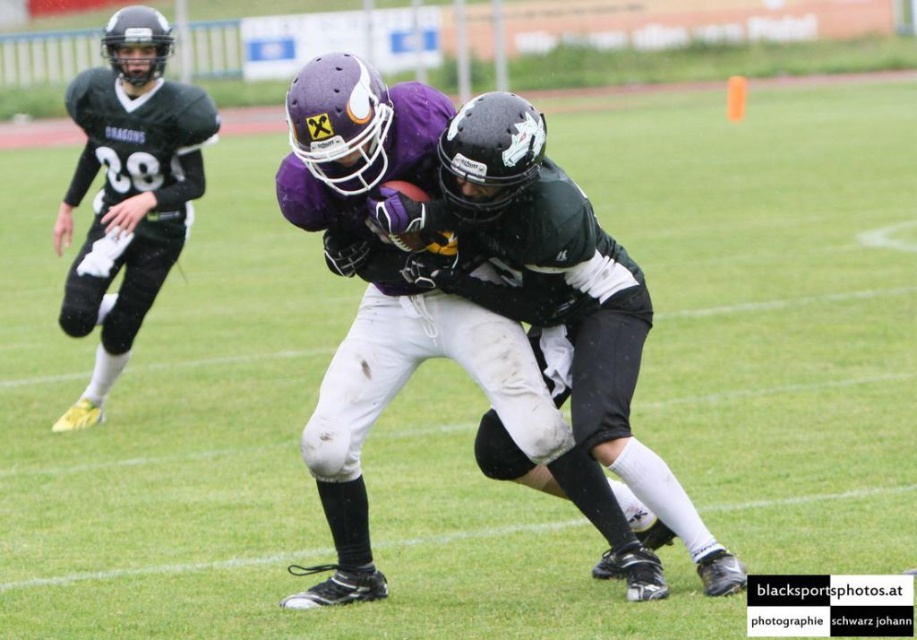
Question: Does purple matte football helmet at center appear on the left side of matte black jersey at left?

Choices:
 (A) yes
 (B) no

Answer: (B)

Question: Is purple matte football helmet at center closer to camera compared to matte black jersey at left?

Choices:
 (A) yes
 (B) no

Answer: (A)

Question: Is the position of purple matte football helmet at center less distant than that of matte black jersey at left?

Choices:
 (A) no
 (B) yes

Answer: (B)